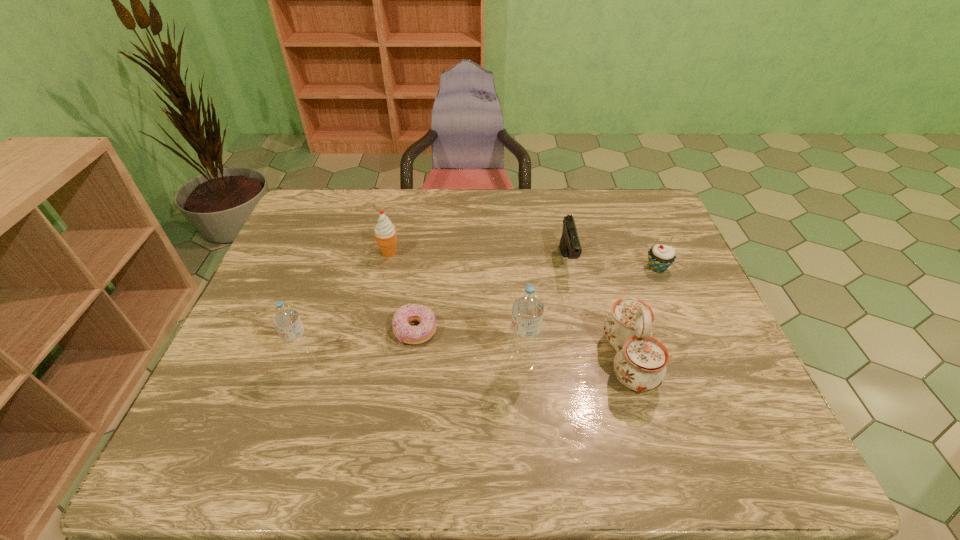
You are a GUI agent. You are given a task and a screenshot of the screen. Output one action in this format:
    pyautogui.click(x=<x>, y=<y>)
    Task: Click on the object positioned at the right edge
    Image resolution: width=960 pixels, height=540 pixels.
    Given the screenshot: What is the action you would take?
    [x=660, y=257]

This screenshot has width=960, height=540. Identify the location of free space at the far edge. (517, 219).

In order to click on vacant position at the near edge of the desktop in this screenshot , I will do `click(284, 384)`.

Image resolution: width=960 pixels, height=540 pixels. Find the location of `blank space at the right edge of the desktop`. blank space at the right edge of the desktop is located at coordinates (725, 352).

Locate an element on the screen. free point between the tallest object and the third object from right to left is located at coordinates (545, 312).

The width and height of the screenshot is (960, 540). I want to click on empty space between the shortest object and the pistol, so tap(492, 296).

Find the location of a particular element. empty space that is in between the icecream and the shortest object is located at coordinates (402, 292).

This screenshot has width=960, height=540. Find the location of `free space between the cupcake and the fifth object from left to right`. free space between the cupcake and the fifth object from left to right is located at coordinates (612, 265).

The height and width of the screenshot is (540, 960). I want to click on unoccupied position between the sixth object from right to left and the third object from right to left, so click(x=478, y=257).

This screenshot has width=960, height=540. In order to click on vacant space that's between the chinaware and the third object from right to left in this screenshot , I will do `click(598, 311)`.